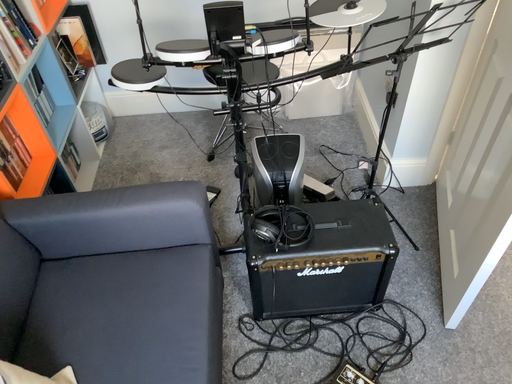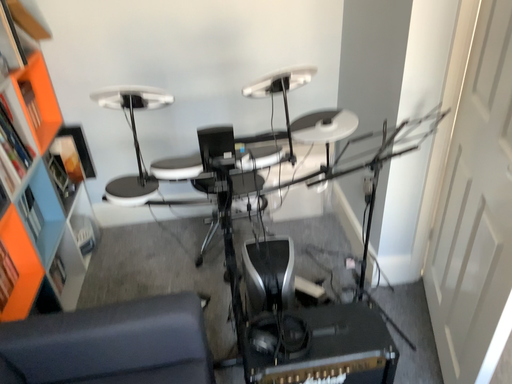
Question: How did the camera likely rotate when shooting the video?

Choices:
 (A) rotated upward
 (B) rotated downward

Answer: (A)